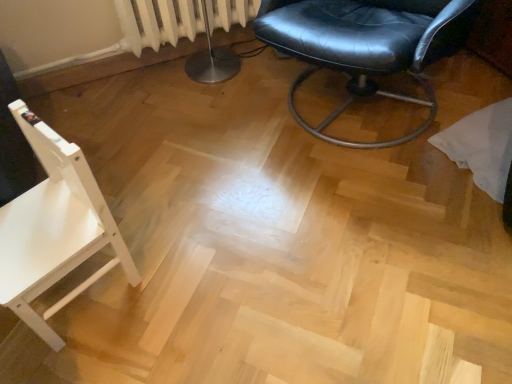
Find the location of a particular element. The height and width of the screenshot is (384, 512). vacant region in front of white wood chair at left, the first chair in the left-to-right sequence is located at coordinates (74, 355).